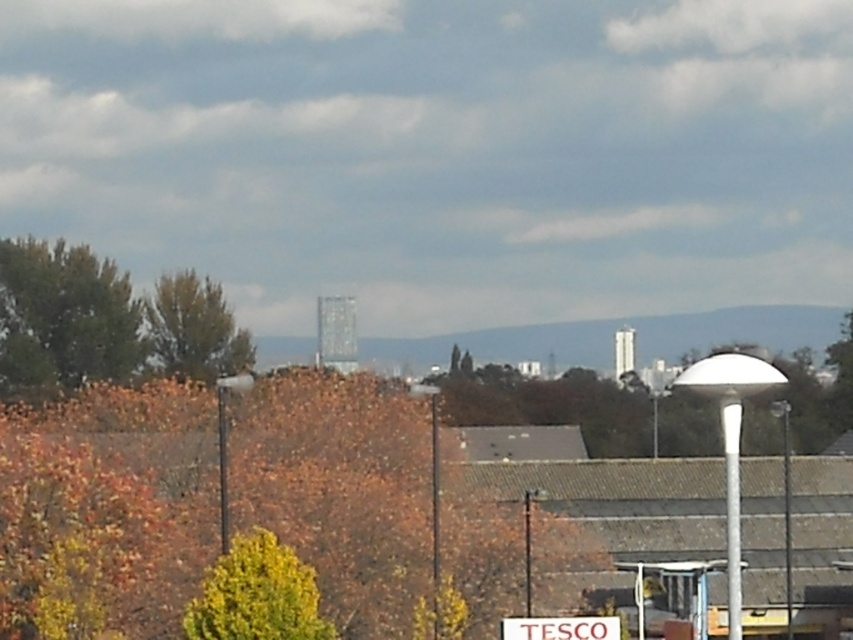
Image resolution: width=853 pixels, height=640 pixels. What do you see at coordinates (112, 497) in the screenshot?
I see `orange autumn leaves at lower left` at bounding box center [112, 497].

Identify the location of orange autumn leaves at lower left. (112, 497).

You are a GUI agent. You are given a task and a screenshot of the screen. Output one action in this format:
    pyautogui.click(x=<x>, y=<y>)
    Task: Click on the orange autumn leaves at lower left
    The height and width of the screenshot is (640, 853).
    Given the screenshot: What is the action you would take?
    pyautogui.click(x=112, y=497)

Does green leafy tree at left appear on the right side of green leafy tree at lower left?

Incorrect, green leafy tree at left is not on the right side of green leafy tree at lower left.

Which is below, green leafy tree at left or green leafy tree at lower left?

green leafy tree at lower left

Locate an element on the screen. green leafy tree at left is located at coordinates (62, 316).

Is point (312, 584) positioned behind point (192, 291)?

No, (312, 584) is in front of (192, 291).

Can you confirm if green leafy tree at lower left is bigger than green leafy tree at upper left?

No.

I want to click on green leafy tree at lower left, so click(257, 595).

What are the coordinates of `green leafy tree at lower left` in the screenshot? It's located at (257, 595).